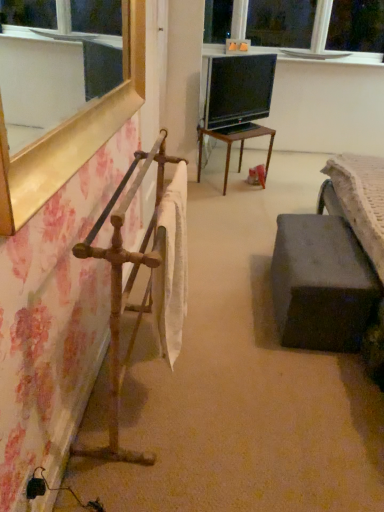
Question: From a real-world perspective, does black glossy tv at center sit lower than wooden table at center?

Choices:
 (A) yes
 (B) no

Answer: (B)

Question: Is black glossy tv at center bigger than wooden table at center?

Choices:
 (A) no
 (B) yes

Answer: (A)

Question: From the image's perspective, is black glossy tv at center over wooden table at center?

Choices:
 (A) yes
 (B) no

Answer: (A)

Question: Is black glossy tv at center not within wooden table at center?

Choices:
 (A) no
 (B) yes

Answer: (B)

Question: Does black glossy tv at center lie in front of wooden table at center?

Choices:
 (A) yes
 (B) no

Answer: (A)

Question: From the image's perspective, is rusty metal towel rack at left above or below white glossy window sill at upper center?

Choices:
 (A) below
 (B) above

Answer: (A)

Question: Does point (110, 328) appear closer or farther from the camera than point (203, 48)?

Choices:
 (A) closer
 (B) farther

Answer: (A)

Question: Considering the relative positions of rusty metal towel rack at left and white glossy window sill at upper center in the image provided, is rusty metal towel rack at left to the left or to the right of white glossy window sill at upper center?

Choices:
 (A) right
 (B) left

Answer: (B)

Question: Considering the positions of rusty metal towel rack at left and white glossy window sill at upper center in the image, is rusty metal towel rack at left wider or thinner than white glossy window sill at upper center?

Choices:
 (A) wide
 (B) thin

Answer: (A)

Question: Is black glossy tv at center wider or thinner than wooden table at center?

Choices:
 (A) wide
 (B) thin

Answer: (B)

Question: Relative to wooden table at center, is black glossy tv at center in front or behind?

Choices:
 (A) front
 (B) behind

Answer: (A)

Question: Which is correct: black glossy tv at center is inside wooden table at center, or outside of it?

Choices:
 (A) inside
 (B) outside

Answer: (B)

Question: Looking at the image, does black glossy tv at center seem bigger or smaller compared to wooden table at center?

Choices:
 (A) small
 (B) big

Answer: (A)

Question: Relative to wooden table at center, is white glossy window sill at upper center in front or behind?

Choices:
 (A) front
 (B) behind

Answer: (B)

Question: From a real-world perspective, is white glossy window sill at upper center positioned above or below wooden table at center?

Choices:
 (A) above
 (B) below

Answer: (A)